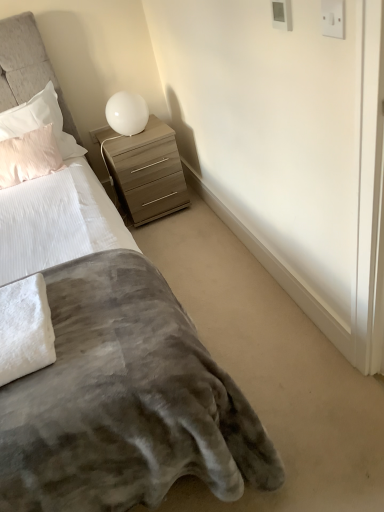
Question: Would you say white plastic electric outlet at upper right, placed as the second electric outlet when sorted from top to bottom, is part of velvet gray blanket at lower left's contents?

Choices:
 (A) no
 (B) yes

Answer: (A)

Question: From the image's perspective, is velvet gray blanket at lower left on white plastic electric outlet at upper right, the second electric outlet positioned from the left?

Choices:
 (A) yes
 (B) no

Answer: (B)

Question: From a real-world perspective, is velvet gray blanket at lower left beneath white plastic electric outlet at upper right, which is the second electric outlet in back-to-front order?

Choices:
 (A) no
 (B) yes

Answer: (B)

Question: Is velvet gray blanket at lower left in front of white plastic electric outlet at upper right, positioned as the first electric outlet in front-to-back order?

Choices:
 (A) yes
 (B) no

Answer: (A)

Question: Can you confirm if velvet gray blanket at lower left is shorter than white plastic electric outlet at upper right, placed as the second electric outlet when sorted from top to bottom?

Choices:
 (A) yes
 (B) no

Answer: (B)

Question: In terms of width, does pink satin pillow at upper left, which is counted as the second pillow, starting from the bottom, look wider or thinner when compared to pale pink plush pillow at upper left, the 1th pillow in the bottom-to-top sequence?

Choices:
 (A) wide
 (B) thin

Answer: (A)

Question: From a real-world perspective, is pink satin pillow at upper left, which is counted as the second pillow, starting from the bottom, positioned above or below pale pink plush pillow at upper left, the 1th pillow in the bottom-to-top sequence?

Choices:
 (A) above
 (B) below

Answer: (A)

Question: Is pink satin pillow at upper left, which is counted as the second pillow, starting from the bottom, situated inside pale pink plush pillow at upper left, the 1th pillow in the bottom-to-top sequence, or outside?

Choices:
 (A) inside
 (B) outside

Answer: (B)

Question: Is pink satin pillow at upper left, which is the first pillow from top to bottom, in front of or behind pale pink plush pillow at upper left, the 1th pillow in the bottom-to-top sequence, in the image?

Choices:
 (A) front
 (B) behind

Answer: (B)

Question: Is pale pink plush pillow at upper left, which appears as the second pillow when viewed from the top, taller or shorter than velvet gray blanket at lower left?

Choices:
 (A) tall
 (B) short

Answer: (B)

Question: Is pale pink plush pillow at upper left, which appears as the second pillow when viewed from the top, situated inside velvet gray blanket at lower left or outside?

Choices:
 (A) inside
 (B) outside

Answer: (A)

Question: Based on their positions, is pale pink plush pillow at upper left, which appears as the second pillow when viewed from the top, located to the left or right of velvet gray blanket at lower left?

Choices:
 (A) left
 (B) right

Answer: (A)

Question: Is pale pink plush pillow at upper left, the 1th pillow in the bottom-to-top sequence, bigger or smaller than velvet gray blanket at lower left?

Choices:
 (A) small
 (B) big

Answer: (A)

Question: From the image's perspective, is white plastic electric outlet at upper right, placed as the second electric outlet when sorted from top to bottom, above or below white fluffy towel at lower left?

Choices:
 (A) below
 (B) above

Answer: (B)

Question: From a real-world perspective, is white plastic electric outlet at upper right, placed as the second electric outlet when sorted from top to bottom, positioned above or below white fluffy towel at lower left?

Choices:
 (A) below
 (B) above

Answer: (B)